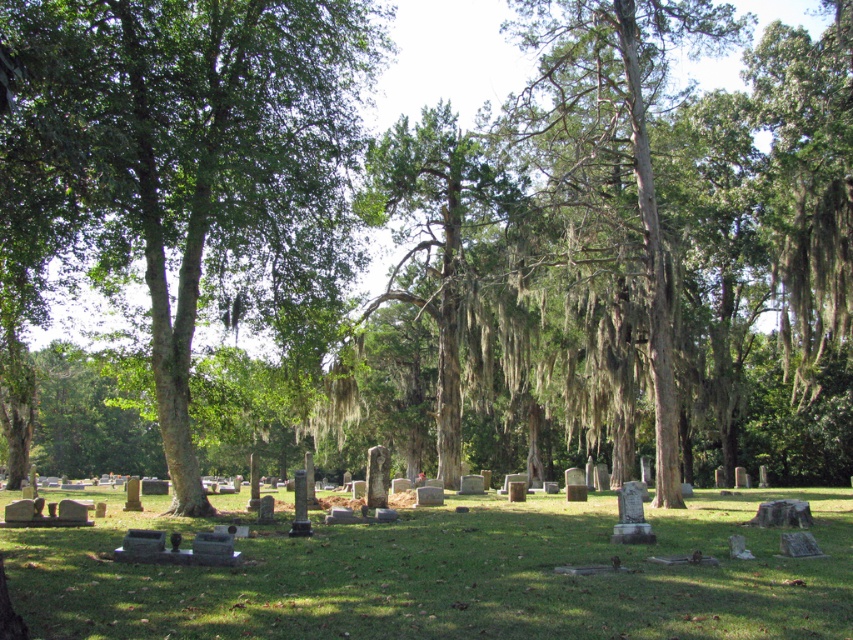
Who is more forward, (627, 116) or (374, 212)?

Positioned in front is point (374, 212).

Is green mossy bark tree at center shorter than green mossy tree at center?

Correct, green mossy bark tree at center is not as tall as green mossy tree at center.

Who is more forward, (569, 22) or (419, 314)?

Point (569, 22) is more forward.

Image resolution: width=853 pixels, height=640 pixels. I want to click on green mossy bark tree at center, so click(x=607, y=198).

Is green leafy tree at left to the right of green mossy bark tree at center from the viewer's perspective?

In fact, green leafy tree at left is to the left of green mossy bark tree at center.

Can you confirm if green leafy tree at left is wider than green mossy bark tree at center?

Correct, the width of green leafy tree at left exceeds that of green mossy bark tree at center.

Who is more distant from viewer, (213, 150) or (598, 20)?

Positioned behind is point (598, 20).

The height and width of the screenshot is (640, 853). In order to click on green leafy tree at left in this screenshot , I will do `click(189, 150)`.

Does green leafy tree at left appear on the left side of green mossy tree at center?

Yes, green leafy tree at left is to the left of green mossy tree at center.

Who is higher up, green leafy tree at left or green mossy tree at center?

Positioned higher is green mossy tree at center.

Who is more distant from viewer, (122, 64) or (442, 461)?

Point (442, 461)

Identify the location of green leafy tree at left. coord(189,150).